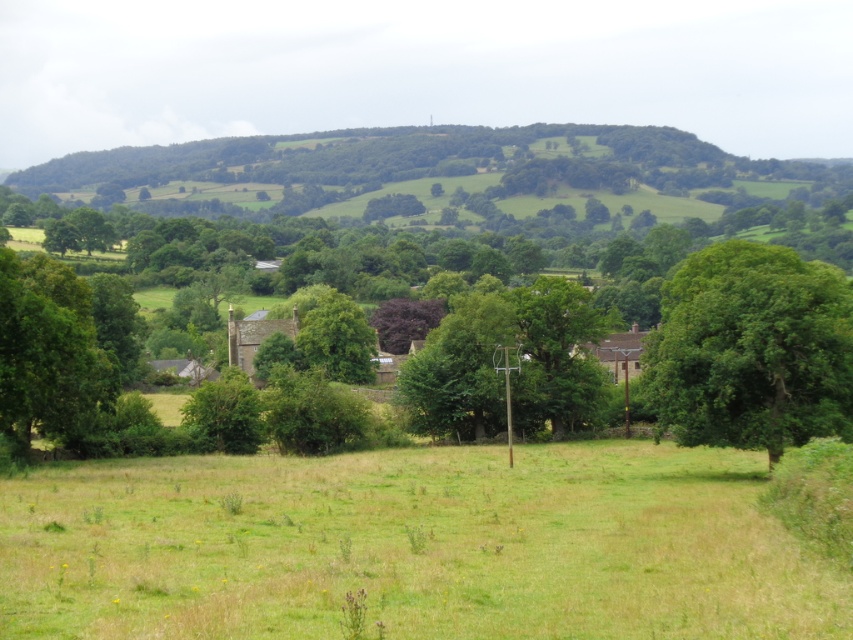
You are standing in the middle of the field and see the green leafy tree at right and the green leafy tree at left. Which tree is positioned higher up in the image?

The green leafy tree at right is located above the green leafy tree at left in the image.

You are standing in the middle of the field and want to determine which tree is taller between the green leafy tree at right and the green leafy tree at left. Based on the scene, which one is taller?

The green leafy tree at right is much taller than the green leafy tree at left, so the one on the right is taller.

You are standing in the rural landscape and want to take a photo of the green grass at lower center and the green leafy tree at left. Which object should you point your camera towards first if you want to capture both in the same frame?

You should point your camera towards the green grass at lower center first because it is located below the green leafy tree at left, allowing both to be captured in the same frame by adjusting the angle to include the lower grass and the tree above it.